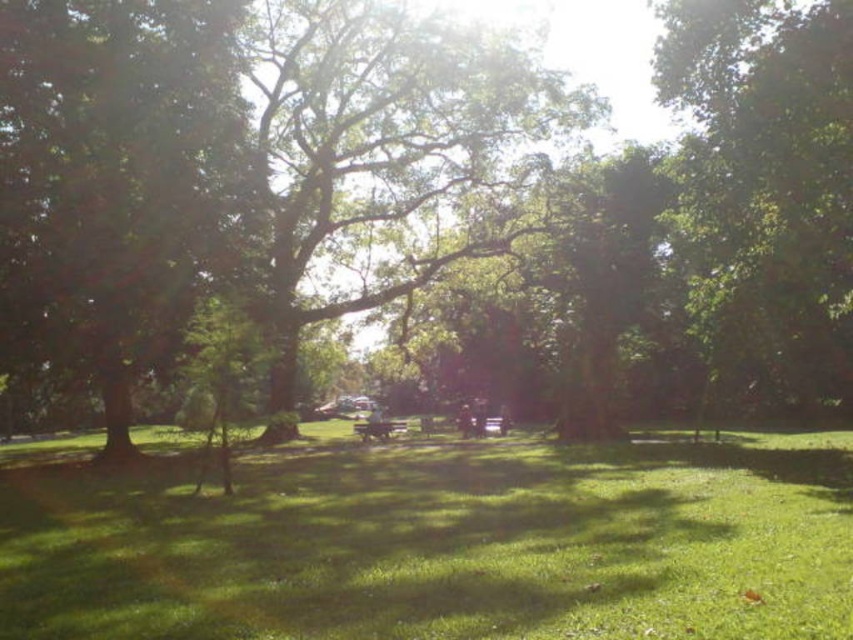
You are standing at the entrance of the park and want to take a photo of the green leafy tree at center. If your camera can focus up to 50 feet away, will you be able to capture the tree clearly?

The green leafy tree at center is 50.31 feet away from the camera. Since the camera can focus up to 50 feet, it cannot focus beyond that distance. Therefore, the tree is slightly out of the camera range and might not be captured clearly.

You are sitting on the wooden park bench at center and want to look at the green leafy tree at right. Can you see the entire tree without moving your head?

The green leafy tree at right is in front of the wooden park bench at center, so you can see the entire tree without moving your head because it is not blocked by the bench.